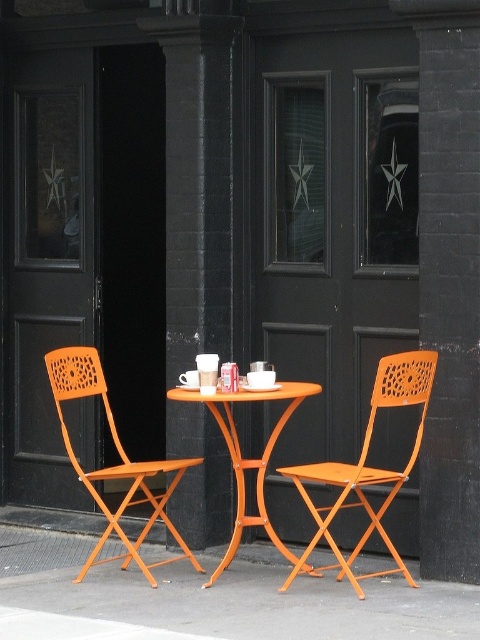
Question: Estimate the real-world distances between objects in this image. Which object is farther from the orange plastic chair at left?

Choices:
 (A) orange wood pavement at lower center
 (B) orange metal chair at center

Answer: (B)

Question: Does orange metal chair at center have a smaller size compared to orange plastic chair at left?

Choices:
 (A) yes
 (B) no

Answer: (A)

Question: From the image, what is the correct spatial relationship of orange wood pavement at lower center in relation to orange plastic chair at left?

Choices:
 (A) left
 (B) right

Answer: (B)

Question: Estimate the real-world distances between objects in this image. Which object is farther from the orange plastic chair at left?

Choices:
 (A) orange wood pavement at lower center
 (B) orange metal chair at center

Answer: (B)

Question: Estimate the real-world distances between objects in this image. Which object is closer to the orange plastic chair at left?

Choices:
 (A) orange wood table at center
 (B) orange wood pavement at lower center

Answer: (A)

Question: Is the position of orange plastic chair at left less distant than that of orange wood table at center?

Choices:
 (A) yes
 (B) no

Answer: (B)